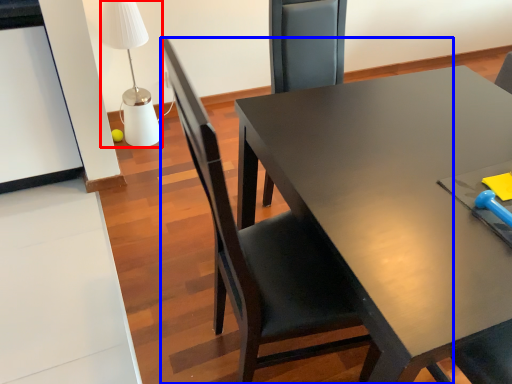
Question: Which point is closer to the camera, table lamp (highlighted by a red box) or chair (highlighted by a blue box)?

Choices:
 (A) table lamp
 (B) chair

Answer: (B)